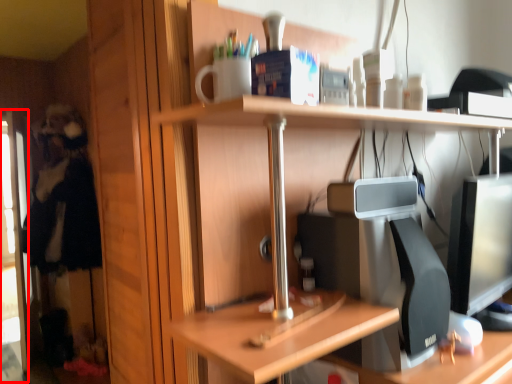
Question: From the image's perspective, what is the correct spatial positioning of screen door (annotated by the red box) in reference to person?

Choices:
 (A) below
 (B) above

Answer: (A)